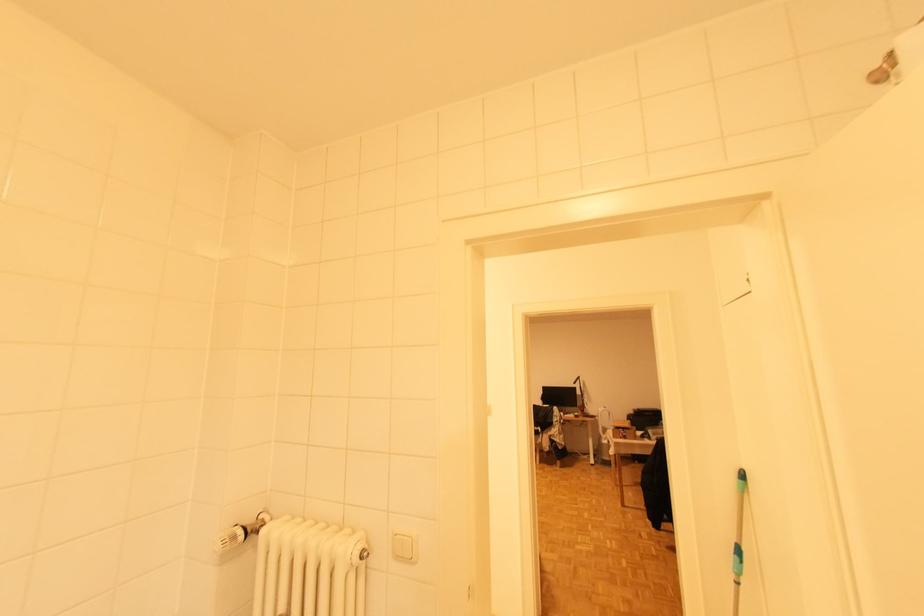
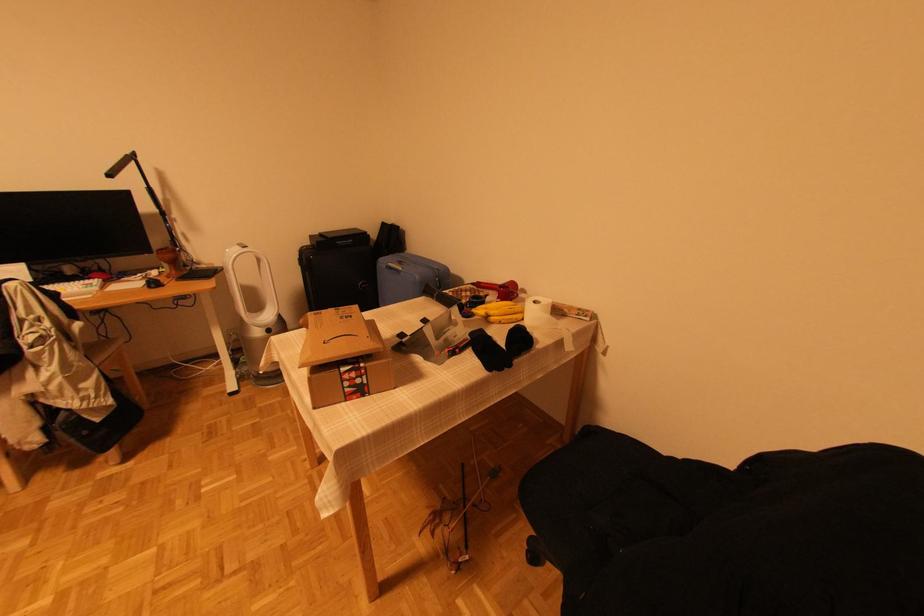
Find the pixel in the second image that matches [637,410] in the first image.

(314, 238)